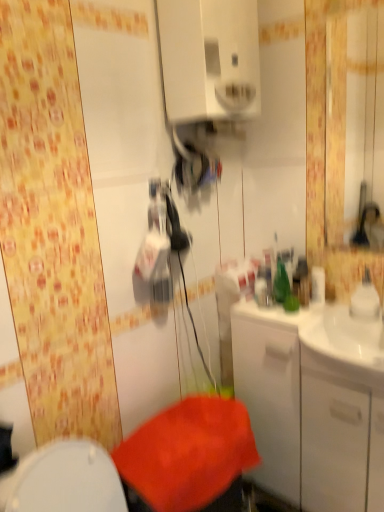
Locate an element on the screen. The image size is (384, 512). white glossy medicine cabinet at upper center is located at coordinates (209, 59).

Identify the location of white glossy cabinet at right. The width and height of the screenshot is (384, 512). (312, 404).

How distant is glossy plastic mirror at upper right from white glossy medicine cabinet at upper center?

The distance of glossy plastic mirror at upper right from white glossy medicine cabinet at upper center is 4.50 feet.

Between point (332, 78) and point (163, 48), which one is positioned behind?

Point (332, 78)

Between glossy plastic mirror at upper right and white glossy medicine cabinet at upper center, which one has more height?

Standing taller between the two is glossy plastic mirror at upper right.

Are glossy plastic mirror at upper right and white glossy medicine cabinet at upper center located far from each other?

Indeed, glossy plastic mirror at upper right is not near white glossy medicine cabinet at upper center.

Does white glossy cabinet at right turn towards glossy plastic mirror at upper right?

No, white glossy cabinet at right is not aimed at glossy plastic mirror at upper right.

Is white glossy cabinet at right bigger than glossy plastic mirror at upper right?

Correct, white glossy cabinet at right is larger in size than glossy plastic mirror at upper right.

Can you tell me how much white glossy cabinet at right and glossy plastic mirror at upper right differ in facing direction?

There is a 0.166-degree angle between the facing directions of white glossy cabinet at right and glossy plastic mirror at upper right.

Visually, is white glossy cabinet at right positioned to the left or to the right of glossy plastic mirror at upper right?

white glossy cabinet at right is positioned on glossy plastic mirror at upper right's left side.

From a real-world perspective, is glossy plastic mirror at upper right physically above white glossy cabinet at right?

Correct, in the physical world, glossy plastic mirror at upper right is higher than white glossy cabinet at right.

How different are the orientations of glossy plastic mirror at upper right and white glossy cabinet at right in degrees?

0.166 degrees separate the facing orientations of glossy plastic mirror at upper right and white glossy cabinet at right.

Considering the points (330, 167) and (287, 399), which point is in front, point (330, 167) or point (287, 399)?

Positioned in front is point (287, 399).

Considering the relative sizes of white glossy medicine cabinet at upper center and white glossy cabinet at right in the image provided, is white glossy medicine cabinet at upper center smaller than white glossy cabinet at right?

Yes, white glossy medicine cabinet at upper center is smaller than white glossy cabinet at right.

Is the position of white glossy medicine cabinet at upper center more distant than that of white glossy cabinet at right?

No.

Considering the positions of points (241, 110) and (306, 312), is point (241, 110) closer to camera compared to point (306, 312)?

Yes, it is.

Considering the relative sizes of white glossy medicine cabinet at upper center and white glossy cabinet at right in the image provided, is white glossy medicine cabinet at upper center shorter than white glossy cabinet at right?

Correct, white glossy medicine cabinet at upper center is not as tall as white glossy cabinet at right.

Looking at their sizes, would you say white glossy cabinet at right is wider or thinner than white glossy medicine cabinet at upper center?

Considering their sizes, white glossy cabinet at right looks broader than white glossy medicine cabinet at upper center.

In the image, is white glossy cabinet at right on the left side or the right side of white glossy medicine cabinet at upper center?

white glossy cabinet at right is positioned on white glossy medicine cabinet at upper center's right side.

Is white glossy cabinet at right turned away from white glossy medicine cabinet at upper center?

No, white glossy medicine cabinet at upper center is not at the back of white glossy cabinet at right.

Is white glossy cabinet at right inside or outside of white glossy medicine cabinet at upper center?

white glossy cabinet at right exists outside the volume of white glossy medicine cabinet at upper center.

Can you tell me how much white glossy medicine cabinet at upper center and glossy plastic mirror at upper right differ in facing direction?

They differ by 89.7 degrees in their facing directions.

Between white glossy medicine cabinet at upper center and glossy plastic mirror at upper right, which one is positioned in front?

Positioned in front is white glossy medicine cabinet at upper center.

Is white glossy medicine cabinet at upper center inside the boundaries of glossy plastic mirror at upper right, or outside?

white glossy medicine cabinet at upper center is located beyond the bounds of glossy plastic mirror at upper right.

Is point (230, 105) positioned behind point (372, 51)?

No, it is in front of (372, 51).

In order to click on mirror behind the white glossy medicine cabinet at upper center in this screenshot , I will do `click(336, 120)`.

This screenshot has height=512, width=384. Identify the location of bathroom cabinet that appears below the glossy plastic mirror at upper right (from a real-world perspective). point(312,404).

Considering their positions, is glossy plastic mirror at upper right positioned closer to white glossy medicine cabinet at upper center than white glossy cabinet at right?

Based on the image, white glossy cabinet at right appears to be nearer to white glossy medicine cabinet at upper center.

From the picture: Considering their positions, is white glossy medicine cabinet at upper center positioned closer to glossy plastic mirror at upper right than white glossy cabinet at right?

white glossy medicine cabinet at upper center lies closer to glossy plastic mirror at upper right than the other object.

Estimate the real-world distances between objects in this image. Which object is further from white glossy cabinet at right, white glossy medicine cabinet at upper center or glossy plastic mirror at upper right?

glossy plastic mirror at upper right.

Based on their spatial positions, is white glossy cabinet at right or glossy plastic mirror at upper right further from white glossy medicine cabinet at upper center?

glossy plastic mirror at upper right.

From the image, which object appears to be farther from glossy plastic mirror at upper right, white glossy cabinet at right or white glossy medicine cabinet at upper center?

Among the two, white glossy cabinet at right is located further to glossy plastic mirror at upper right.

Based on their spatial positions, is glossy plastic mirror at upper right or white glossy medicine cabinet at upper center closer to white glossy cabinet at right?

white glossy medicine cabinet at upper center lies closer to white glossy cabinet at right than the other object.

Find the location of `mirror between white glossy medicine cabinet at upper center and white glossy cabinet at right in the up-down direction`. mirror between white glossy medicine cabinet at upper center and white glossy cabinet at right in the up-down direction is located at coordinates point(336,120).